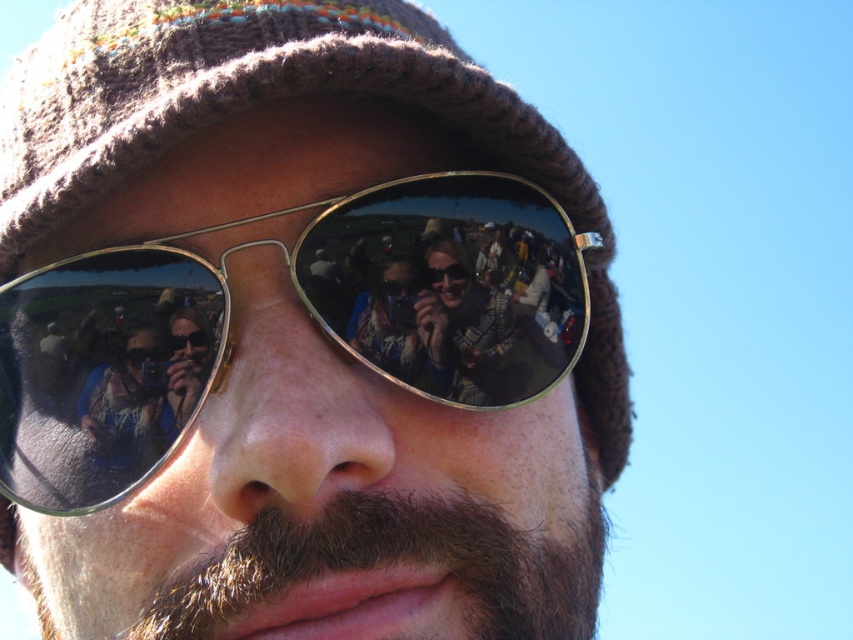
Question: Which object is closer to the camera taking this photo?

Choices:
 (A) gold reflective sunglasses at center
 (B) dark brown fuzzy beard at center
 (C) plaid fabric shirt at center

Answer: (B)

Question: Is dark brown fuzzy beard at center to the right of plaid fabric shirt at center from the viewer's perspective?

Choices:
 (A) no
 (B) yes

Answer: (A)

Question: Is gold reflective sunglasses at center to the right of plaid fabric shirt at center from the viewer's perspective?

Choices:
 (A) yes
 (B) no

Answer: (B)

Question: Which of the following is the farthest from the observer?

Choices:
 (A) plaid fabric shirt at center
 (B) dark brown fuzzy beard at center

Answer: (A)

Question: Which point is farther to the camera?

Choices:
 (A) plaid fabric shirt at center
 (B) dark brown fuzzy beard at center

Answer: (A)

Question: Can you confirm if gold reflective sunglasses at center is positioned below plaid fabric shirt at center?

Choices:
 (A) yes
 (B) no

Answer: (A)